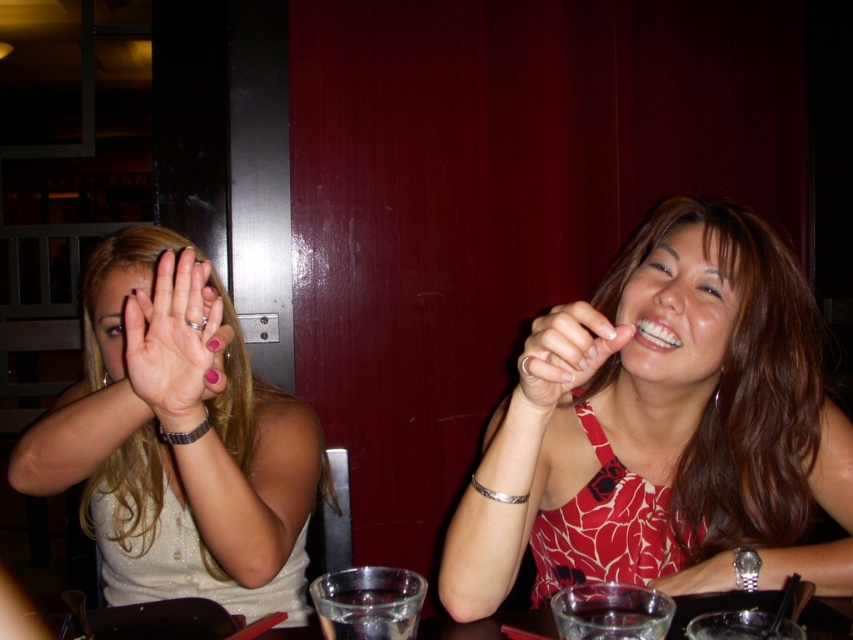
You are a photographer standing at a point 30 inches away from the camera. You want to take a photo of the scene shown in the image. If the point labeled as point (566, 364) is part of the scene, will you be able to capture it in your photo?

The point (566, 364) is 27.92 inches away from the camera, which is within the 30 inches distance you are standing from the camera. Therefore, you will be able to capture it in your photo.

You are a fashion designer observing two outfits in the image. The matte white blouse at center and the smooth red dress at center are both placed on a mannequin. If you want to create a new outfit that is narrower than both, which one should you use as a reference for the narrower width?

The smooth red dress at center has a narrower width than the matte white blouse at center. To create a narrower outfit, use the smooth red dress at center as a reference.